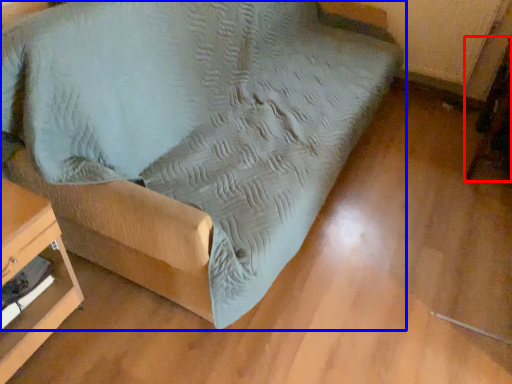
Question: Which object appears closest to the camera in this image, swivel chair (highlighted by a red box) or furniture (highlighted by a blue box)?

Choices:
 (A) swivel chair
 (B) furniture

Answer: (B)